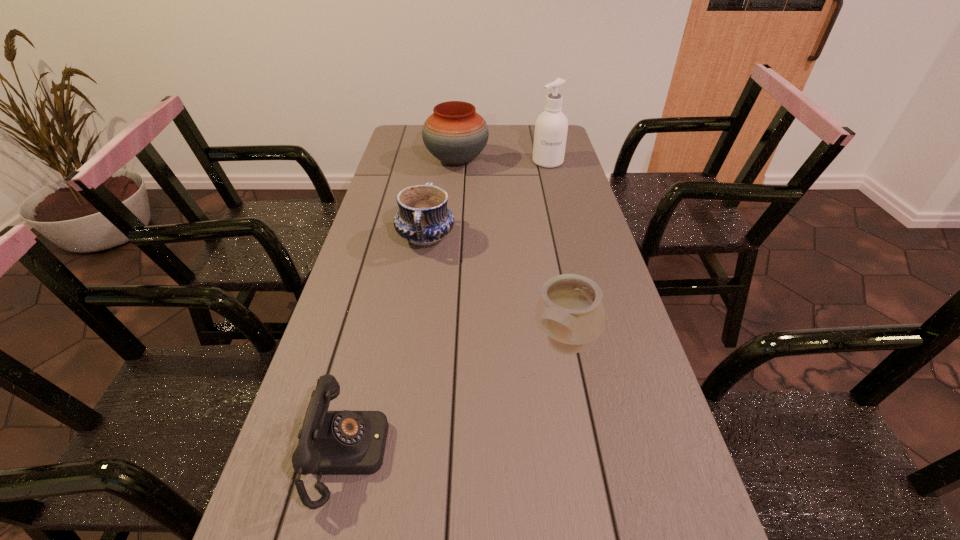
This screenshot has width=960, height=540. In order to click on cleansing agent in this screenshot , I will do `click(551, 127)`.

At what (x,y) coordinates should I click in order to perform the action: click on the farthest pottery. Please return your answer as a coordinate pair (x, y). Image resolution: width=960 pixels, height=540 pixels. Looking at the image, I should click on (455, 134).

This screenshot has height=540, width=960. I want to click on the nearest pottery, so click(x=570, y=311).

This screenshot has height=540, width=960. I want to click on the fourth farthest object, so click(570, 311).

This screenshot has width=960, height=540. In order to click on the third farthest object in this screenshot , I will do `click(423, 219)`.

You are a GUI agent. You are given a task and a screenshot of the screen. Output one action in this format:
    pyautogui.click(x=<x>, y=<y>)
    Task: Click on the second nearest pottery
    The width and height of the screenshot is (960, 540).
    Given the screenshot: What is the action you would take?
    pyautogui.click(x=423, y=219)

You are a GUI agent. You are given a task and a screenshot of the screen. Output one action in this format:
    pyautogui.click(x=<x>, y=<y>)
    Task: Click on the shortest object
    
    Given the screenshot: What is the action you would take?
    pyautogui.click(x=345, y=442)

You are a GUI agent. You are given a task and a screenshot of the screen. Output one action in this format:
    pyautogui.click(x=<x>, y=<y>)
    Task: Click on the nearest object
    Image resolution: width=960 pixels, height=540 pixels.
    Given the screenshot: What is the action you would take?
    pyautogui.click(x=345, y=442)

Where is `free location located 0.120m on the front label of the tallest object`? The height and width of the screenshot is (540, 960). free location located 0.120m on the front label of the tallest object is located at coordinates [x=554, y=185].

I want to click on vacant space located 0.310m on the right of the farthest pottery, so click(x=568, y=161).